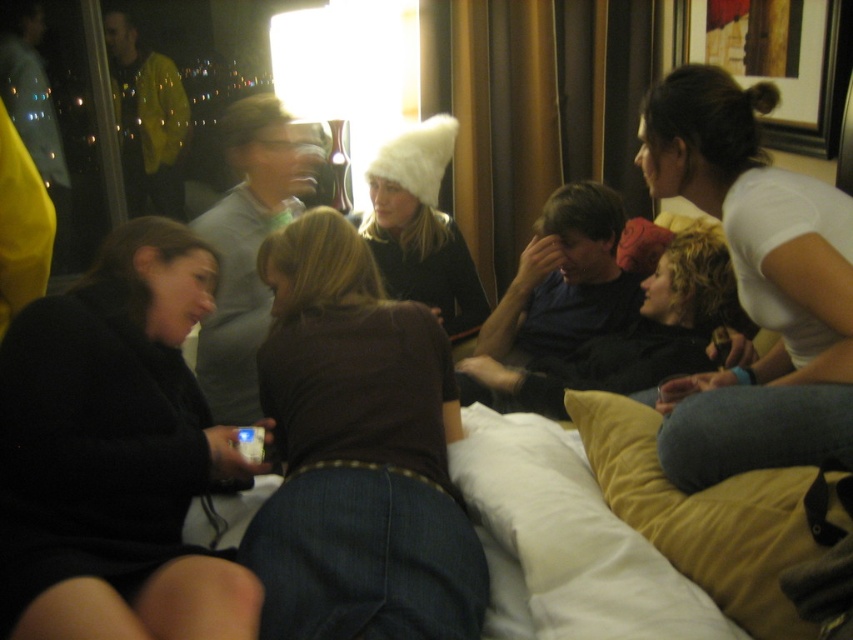
What do you see at coordinates (114, 454) in the screenshot? I see `black matte jacket at lower left` at bounding box center [114, 454].

Who is positioned more to the right, black matte jacket at lower left or white fuzzy hat at center?

white fuzzy hat at center

The height and width of the screenshot is (640, 853). What do you see at coordinates (114, 454) in the screenshot?
I see `black matte jacket at lower left` at bounding box center [114, 454].

Locate an element on the screen. black matte jacket at lower left is located at coordinates (114, 454).

Can you confirm if black matte jacket at lower left is thinner than brown fabric shirt at center?

No, black matte jacket at lower left is not thinner than brown fabric shirt at center.

Is point (78, 483) closer to camera compared to point (437, 611)?

That is False.

Does point (93, 467) lie behind point (291, 241)?

No.

Locate an element on the screen. black matte jacket at lower left is located at coordinates (114, 454).

Is white soft pillow at lower center bigger than white fuzzy hat at center?

No.

Which is in front, point (573, 493) or point (405, 156)?

Point (573, 493) is in front.

Identify the location of white soft pillow at lower center. (567, 541).

This screenshot has height=640, width=853. What are the coordinates of `white soft pillow at lower center` in the screenshot? It's located at (567, 541).